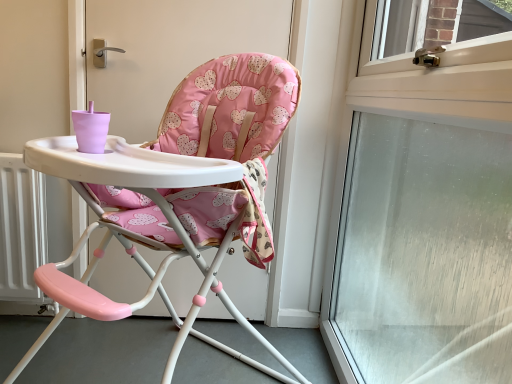
At what (x,y) coordinates should I click in order to perform the action: click on transparent glass window at upper right. Please return your answer as a coordinate pair (x, y). The image size is (512, 384). Looking at the image, I should click on (423, 215).

This screenshot has width=512, height=384. Describe the element at coordinates (423, 215) in the screenshot. I see `transparent glass window at upper right` at that location.

In order to face pink fabric highchair at center, should I rotate leftwards or rightwards?

Turn left approximately 11.940 degrees to face it.

This screenshot has width=512, height=384. What do you see at coordinates (180, 193) in the screenshot?
I see `pink fabric highchair at center` at bounding box center [180, 193].

Locate an element on the screen. pink fabric highchair at center is located at coordinates (180, 193).

This screenshot has height=384, width=512. What are the coordinates of `transparent glass window at upper right` in the screenshot? It's located at (423, 215).

Consider the image. Is pink fabric highchair at center at the right side of transparent glass window at upper right?

No.

In the image, is pink fabric highchair at center positioned in front of or behind transparent glass window at upper right?

pink fabric highchair at center is positioned farther from the viewer than transparent glass window at upper right.

Which is nearer, (229,70) or (471,246)?

Clearly, point (229,70) is closer to the camera than point (471,246).

From the image's perspective, is pink fabric highchair at center on top of transparent glass window at upper right?

Incorrect, from the image's perspective, pink fabric highchair at center is lower than transparent glass window at upper right.

From a real-world perspective, who is located lower, pink fabric highchair at center or transparent glass window at upper right?

pink fabric highchair at center is physically lower.

Considering the sizes of objects pink fabric highchair at center and transparent glass window at upper right in the image provided, who is thinner, pink fabric highchair at center or transparent glass window at upper right?

transparent glass window at upper right is thinner.

Between pink fabric highchair at center and transparent glass window at upper right, which one has more height?

With more height is transparent glass window at upper right.

Looking at this image, which of these two, pink fabric highchair at center or transparent glass window at upper right, is smaller?

transparent glass window at upper right.

Does pink fabric highchair at center contain transparent glass window at upper right?

No, transparent glass window at upper right is not inside pink fabric highchair at center.

Is pink fabric highchair at center in contact with transparent glass window at upper right?

Result: pink fabric highchair at center and transparent glass window at upper right are not in contact.

Is pink fabric highchair at center positioned with its back to transparent glass window at upper right?

pink fabric highchair at center is not turned away from transparent glass window at upper right.

You are a GUI agent. You are given a task and a screenshot of the screen. Output one action in this format:
    pyautogui.click(x=<x>, y=<y>)
    Task: Click on the window on the right of pink fabric highchair at center
    
    Given the screenshot: What is the action you would take?
    pyautogui.click(x=423, y=215)

Is transparent glass window at upper right to the right of pink fabric highchair at center from the viewer's perspective?

Correct, you'll find transparent glass window at upper right to the right of pink fabric highchair at center.

Is transparent glass window at upper right further to camera compared to pink fabric highchair at center?

No, transparent glass window at upper right is closer to the viewer.

Is point (325, 338) closer to viewer compared to point (40, 146)?

No, (325, 338) is further to viewer.

From the image's perspective, is transparent glass window at upper right located beneath pink fabric highchair at center?

Incorrect, from the image's perspective, transparent glass window at upper right is higher than pink fabric highchair at center.

From a real-world perspective, is transparent glass window at upper right under pink fabric highchair at center?

No, from a real-world perspective, transparent glass window at upper right is not below pink fabric highchair at center.

Which of these two, transparent glass window at upper right or pink fabric highchair at center, is wider?

pink fabric highchair at center.

Is transparent glass window at upper right shorter than pink fabric highchair at center?

No.

Looking at the image, does transparent glass window at upper right seem bigger or smaller compared to pink fabric highchair at center?

In the image, transparent glass window at upper right appears to be smaller than pink fabric highchair at center.

Is transparent glass window at upper right not within pink fabric highchair at center?

transparent glass window at upper right is positioned outside pink fabric highchair at center.

Is transparent glass window at upper right not near pink fabric highchair at center?

transparent glass window at upper right is near pink fabric highchair at center, not far away.

Is transparent glass window at upper right turned away from pink fabric highchair at center?

Yes, transparent glass window at upper right is positioned with its back facing pink fabric highchair at center.

What's the angular difference between transparent glass window at upper right and pink fabric highchair at center's facing directions?

There is a 47.5-degree angle between the facing directions of transparent glass window at upper right and pink fabric highchair at center.

Measure the distance from transparent glass window at upper right to pink fabric highchair at center.

transparent glass window at upper right and pink fabric highchair at center are 22.54 inches apart.

The image size is (512, 384). Identify the location of window above the pink fabric highchair at center (from the image's perspective). (423, 215).

This screenshot has width=512, height=384. Find the location of `window above the pink fabric highchair at center (from a real-world perspective)`. window above the pink fabric highchair at center (from a real-world perspective) is located at coordinates (423, 215).

Identify the location of chair behind the transparent glass window at upper right. (180, 193).